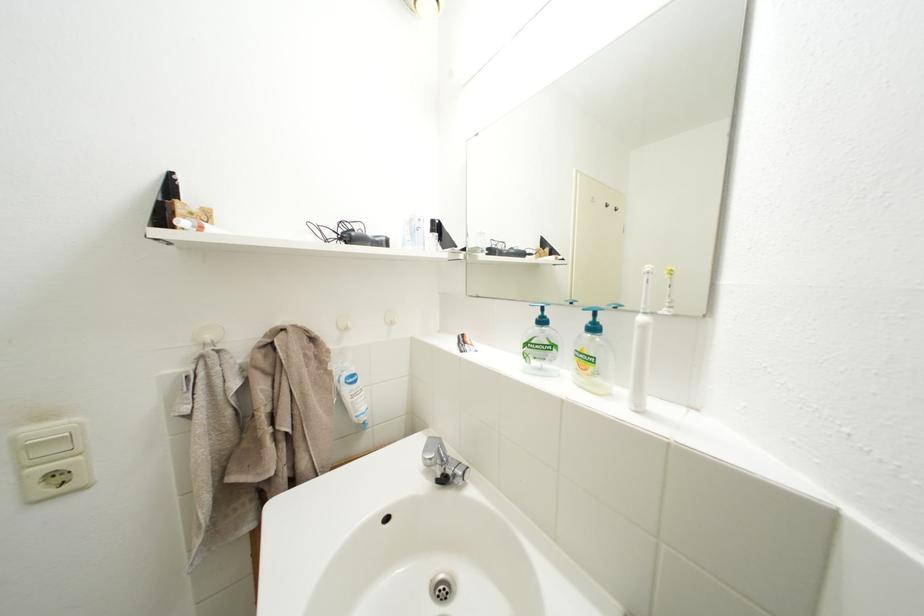
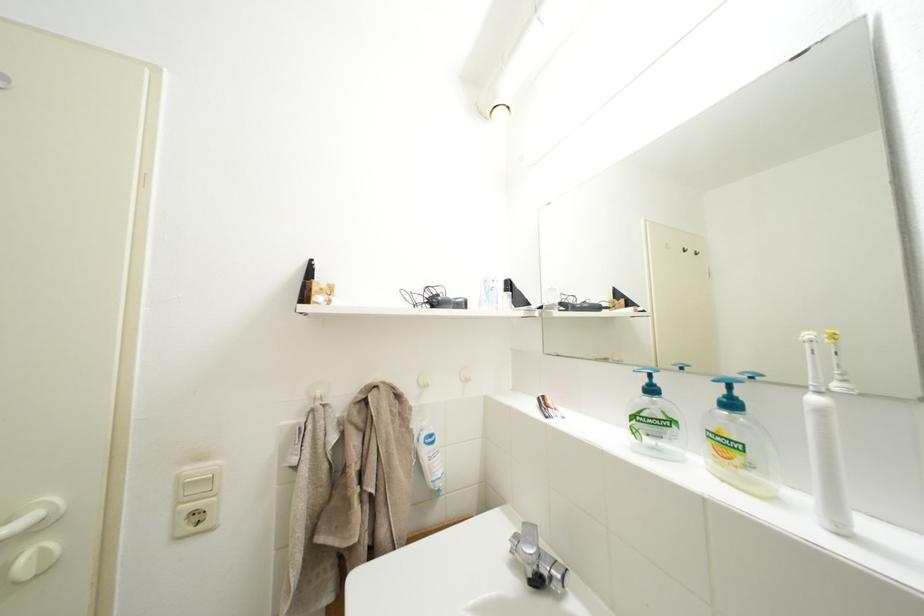
Find the pixel in the second image that matches point 650,323 in the first image.

(823, 405)